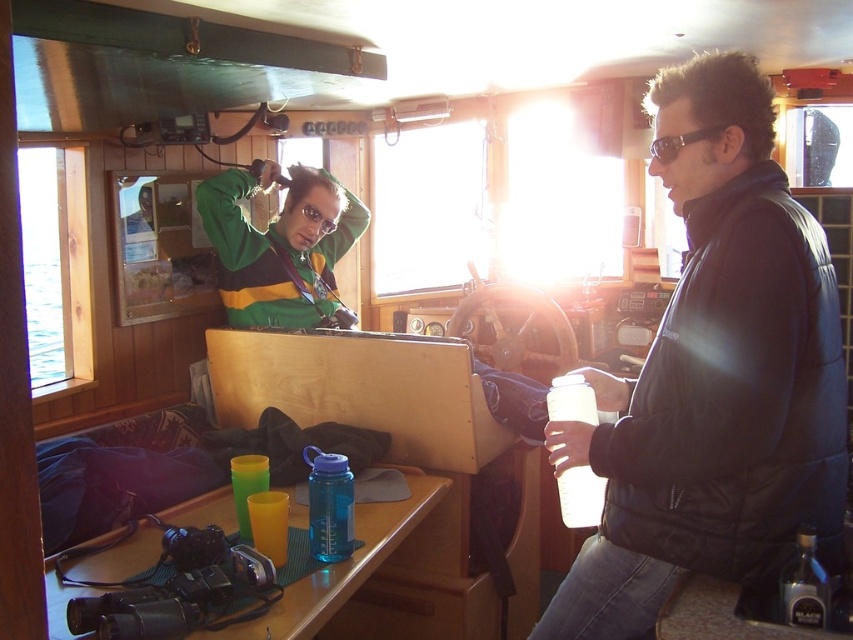
Question: Does green matte jacket at upper left come in front of blue plastic water bottle at lower left?

Choices:
 (A) yes
 (B) no

Answer: (B)

Question: Which point is closer to the camera?

Choices:
 (A) (693, 593)
 (B) (694, 205)
 (C) (701, 134)
 (D) (138, 566)

Answer: (C)

Question: Does matte black jacket at center appear on the right side of black plastic goggles at upper right?

Choices:
 (A) no
 (B) yes

Answer: (B)

Question: Considering the real-world distances, which object is closest to the black plastic goggles at upper right?

Choices:
 (A) matte black jacket at center
 (B) blue plastic water bottle at lower left

Answer: (A)

Question: Can you confirm if blue plastic water bottle at lower left is bigger than black plastic goggles at upper right?

Choices:
 (A) yes
 (B) no

Answer: (A)

Question: Which object is positioned closest to the matte plastic camera at lower right?

Choices:
 (A) blue plastic water bottle at lower left
 (B) green matte jacket at upper left

Answer: (A)